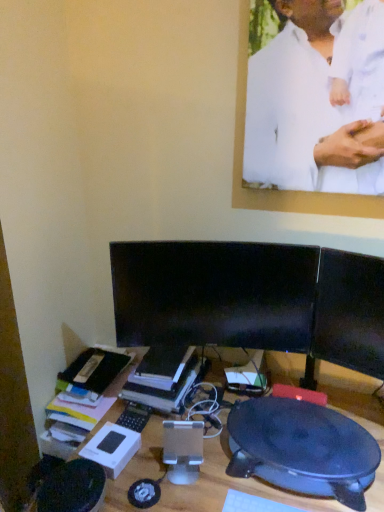
Question: Is white matte shirt at upper center aimed at black glossy monitor at center, positioned as the first computer monitor in right-to-left order?

Choices:
 (A) yes
 (B) no

Answer: (B)

Question: From a real-world perspective, is white matte shirt at upper center physically below black glossy monitor at center, positioned as the first computer monitor in right-to-left order?

Choices:
 (A) yes
 (B) no

Answer: (B)

Question: Is the position of white matte shirt at upper center less distant than that of black glossy monitor at center, positioned as the first computer monitor in right-to-left order?

Choices:
 (A) yes
 (B) no

Answer: (A)

Question: Considering the relative sizes of white matte shirt at upper center and black glossy monitor at center, which is the second computer monitor in left-to-right order, in the image provided, is white matte shirt at upper center bigger than black glossy monitor at center, which is the second computer monitor in left-to-right order,?

Choices:
 (A) no
 (B) yes

Answer: (B)

Question: Can you confirm if white matte shirt at upper center is shorter than black glossy monitor at center, positioned as the first computer monitor in right-to-left order?

Choices:
 (A) yes
 (B) no

Answer: (B)

Question: Considering the relative positions of white matte shirt at upper center and black glossy monitor at center, which is the second computer monitor in left-to-right order, in the image provided, is white matte shirt at upper center to the left of black glossy monitor at center, which is the second computer monitor in left-to-right order, from the viewer's perspective?

Choices:
 (A) no
 (B) yes

Answer: (B)

Question: Can you confirm if white matte shirt at upper center is thinner than black plastic round table at lower right?

Choices:
 (A) no
 (B) yes

Answer: (B)

Question: Would you say black plastic round table at lower right is part of white matte shirt at upper center's contents?

Choices:
 (A) yes
 (B) no

Answer: (B)

Question: Is white matte shirt at upper center looking in the opposite direction of black plastic round table at lower right?

Choices:
 (A) yes
 (B) no

Answer: (B)

Question: Considering the relative positions of white matte shirt at upper center and black plastic round table at lower right in the image provided, is white matte shirt at upper center to the right of black plastic round table at lower right from the viewer's perspective?

Choices:
 (A) yes
 (B) no

Answer: (A)

Question: From the image's perspective, is white matte shirt at upper center under black plastic round table at lower right?

Choices:
 (A) no
 (B) yes

Answer: (A)

Question: Is white matte shirt at upper center wider than black plastic round table at lower right?

Choices:
 (A) no
 (B) yes

Answer: (A)

Question: From the image's perspective, is hardcover book at center under black glossy monitor at center, positioned as the first computer monitor in right-to-left order?

Choices:
 (A) yes
 (B) no

Answer: (A)